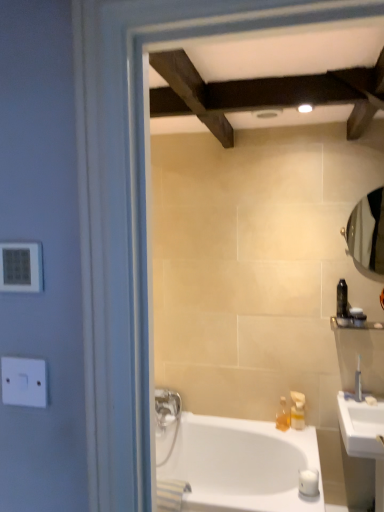
Identify the location of free location in front of translucent plastic soap dispenser at lower right. Image resolution: width=384 pixels, height=512 pixels. (295, 437).